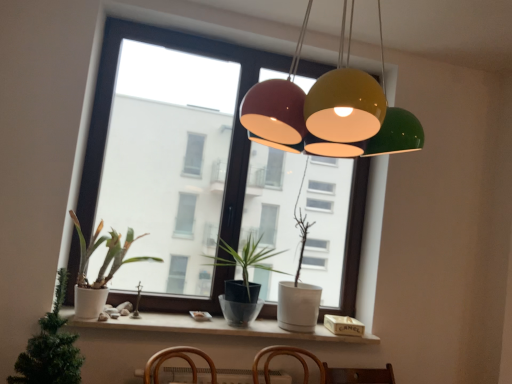
Identify the location of white matte pot at left, acting as the 2th houseplant starting from the back. This screenshot has width=512, height=384. (100, 268).

You are a GUI agent. You are given a task and a screenshot of the screen. Output one action in this format:
    pyautogui.click(x=<x>, y=<y>)
    Task: Click on the white matte pot at left, which is the 1th houseplant in front-to-back order
    This screenshot has width=512, height=384.
    Given the screenshot: What is the action you would take?
    pyautogui.click(x=50, y=349)

Is point (152, 330) closer to viewer compared to point (242, 321)?

That is True.

Is white matte window sill at lower center closer to camera compared to matte black pot at center, arranged as the 1th houseplant when viewed from the back?

Yes, the depth of white matte window sill at lower center is less than that of matte black pot at center, arranged as the 1th houseplant when viewed from the back.

In the scene shown: How different are the orientations of white matte window sill at lower center and matte black pot at center, the third houseplant from the front, in degrees?

The angular difference between white matte window sill at lower center and matte black pot at center, the third houseplant from the front, is 0.824 degrees.

Can you confirm if white matte window sill at lower center is thinner than matte black pot at center, arranged as the 1th houseplant when viewed from the back?

Indeed, white matte window sill at lower center has a lesser width compared to matte black pot at center, arranged as the 1th houseplant when viewed from the back.

From the image's perspective, which one is positioned higher, white matte pot at left, which is the third houseplant in back-to-front order, or matte black pot at center, arranged as the 1th houseplant when viewed from the back?

matte black pot at center, arranged as the 1th houseplant when viewed from the back, from the image's perspective.

Between white matte pot at left, which is the 1th houseplant in front-to-back order, and matte black pot at center, arranged as the 1th houseplant when viewed from the back, which one appears on the right side from the viewer's perspective?

From the viewer's perspective, matte black pot at center, arranged as the 1th houseplant when viewed from the back, appears more on the right side.

Who is more distant, white matte pot at left, which is the third houseplant in back-to-front order, or matte black pot at center, the third houseplant from the front?

Positioned behind is matte black pot at center, the third houseplant from the front.

Could you tell me if white matte pot at left, which is the third houseplant in back-to-front order, is turned towards matte black pot at center, the third houseplant from the front?

No, white matte pot at left, which is the third houseplant in back-to-front order, is not oriented towards matte black pot at center, the third houseplant from the front.

Who is bigger, matte black pot at center, the third houseplant from the front, or white matte window sill at lower center?

matte black pot at center, the third houseplant from the front.

From a real-world perspective, does matte black pot at center, the third houseplant from the front, sit lower than white matte window sill at lower center?

No, from a real-world perspective, matte black pot at center, the third houseplant from the front, is not beneath white matte window sill at lower center.

Is white matte window sill at lower center located within matte black pot at center, the third houseplant from the front?

No, white matte window sill at lower center is not inside matte black pot at center, the third houseplant from the front.

Is point (215, 265) closer or farther from the camera than point (283, 335)?

Point (215, 265).

Considering the positions of point (268, 254) and point (69, 349), is point (268, 254) closer or farther from the camera than point (69, 349)?

Point (268, 254) is positioned farther from the camera compared to point (69, 349).

Could you measure the distance between matte black pot at center, the third houseplant from the front, and white matte pot at left, which is the 1th houseplant in front-to-back order?

matte black pot at center, the third houseplant from the front, is 36.01 inches from white matte pot at left, which is the 1th houseplant in front-to-back order.

Would you consider matte black pot at center, arranged as the 1th houseplant when viewed from the back, to be distant from white matte pot at left, which is the 1th houseplant in front-to-back order?

matte black pot at center, arranged as the 1th houseplant when viewed from the back, is near white matte pot at left, which is the 1th houseplant in front-to-back order, not far away.

Could you tell me if matte black pot at center, the third houseplant from the front, is turned towards white matte pot at left, which is the third houseplant in back-to-front order?

No, matte black pot at center, the third houseplant from the front, does not turn towards white matte pot at left, which is the third houseplant in back-to-front order.

Consider the image. How far apart are transparent glass window at center and white matte window sill at lower center?

78.50 centimeters.

Can white matte window sill at lower center be found inside transparent glass window at center?

No, white matte window sill at lower center is located outside of transparent glass window at center.

From the image's perspective, is transparent glass window at center above white matte window sill at lower center?

Yes, from the image's perspective, transparent glass window at center is over white matte window sill at lower center.

Based on the photo, is transparent glass window at center to the right of white matte window sill at lower center from the viewer's perspective?

Indeed, transparent glass window at center is positioned on the right side of white matte window sill at lower center.

Considering the relative positions of white matte pot at left, which is the third houseplant in back-to-front order, and transparent glass window at center in the image provided, is white matte pot at left, which is the third houseplant in back-to-front order, to the left of transparent glass window at center from the viewer's perspective?

Indeed, white matte pot at left, which is the third houseplant in back-to-front order, is positioned on the left side of transparent glass window at center.

Between white matte pot at left, which is the 1th houseplant in front-to-back order, and transparent glass window at center, which one is positioned behind?

Positioned behind is transparent glass window at center.

Is white matte pot at left, which is the 1th houseplant in front-to-back order, inside or outside of transparent glass window at center?

white matte pot at left, which is the 1th houseplant in front-to-back order, is outside transparent glass window at center.

Considering the sizes of objects white matte pot at left, which is the third houseplant in back-to-front order, and transparent glass window at center in the image provided, who is thinner, white matte pot at left, which is the third houseplant in back-to-front order, or transparent glass window at center?

transparent glass window at center is thinner.

Which object is thinner, matte black pot at center, the third houseplant from the front, or white matte pot at left, acting as the 2th houseplant starting from the back?

Thinner between the two is white matte pot at left, acting as the 2th houseplant starting from the back.

Can you see matte black pot at center, arranged as the 1th houseplant when viewed from the back, touching white matte pot at left, the 2th houseplant positioned from the front?

matte black pot at center, arranged as the 1th houseplant when viewed from the back, and white matte pot at left, the 2th houseplant positioned from the front, are clearly separated.

From the image's perspective, is matte black pot at center, arranged as the 1th houseplant when viewed from the back, under white matte pot at left, acting as the 2th houseplant starting from the back?

Yes, from the image's perspective, matte black pot at center, arranged as the 1th houseplant when viewed from the back, is below white matte pot at left, acting as the 2th houseplant starting from the back.

Is point (227, 300) positioned before point (108, 239)?

No, (227, 300) is further to viewer.

Locate an element on the screen. The width and height of the screenshot is (512, 384). houseplant behind the white matte window sill at lower center is located at coordinates (243, 279).

I want to click on the 2nd houseplant to the right of the white matte pot at left, which is the 1th houseplant in front-to-back order, starting your count from the anchor, so click(243, 279).

When comparing their distances from white matte window sill at lower center, does white matte pot at left, which is the 1th houseplant in front-to-back order, or white matte pot at left, acting as the 2th houseplant starting from the back, seem closer?

The object closer to white matte window sill at lower center is white matte pot at left, acting as the 2th houseplant starting from the back.

Based on the photo, considering their positions, is white matte pot at left, the 2th houseplant positioned from the front, positioned further to white matte window sill at lower center than transparent glass window at center?

Based on the image, transparent glass window at center appears to be further to white matte window sill at lower center.

Which object lies further to the anchor point white matte pot at left, which is the 1th houseplant in front-to-back order, white matte pot at left, the 2th houseplant positioned from the front, or matte black pot at center, arranged as the 1th houseplant when viewed from the back?

matte black pot at center, arranged as the 1th houseplant when viewed from the back, lies further to white matte pot at left, which is the 1th houseplant in front-to-back order, than the other object.

Considering their positions, is transparent glass window at center positioned further to white matte pot at left, which is the third houseplant in back-to-front order, than white matte window sill at lower center?

transparent glass window at center is positioned further to the anchor white matte pot at left, which is the third houseplant in back-to-front order.

Looking at the image, which one is located closer to transparent glass window at center, white matte pot at left, acting as the 2th houseplant starting from the back, or white matte window sill at lower center?

white matte pot at left, acting as the 2th houseplant starting from the back.

From the image, which object appears to be nearer to white matte pot at left, which is the third houseplant in back-to-front order, white matte pot at left, acting as the 2th houseplant starting from the back, or transparent glass window at center?

Based on the image, white matte pot at left, acting as the 2th houseplant starting from the back, appears to be nearer to white matte pot at left, which is the third houseplant in back-to-front order.

Based on their spatial positions, is white matte window sill at lower center or white matte pot at left, acting as the 2th houseplant starting from the back, further from matte black pot at center, the third houseplant from the front?

white matte pot at left, acting as the 2th houseplant starting from the back.

Looking at the image, which one is located further to white matte window sill at lower center, matte black pot at center, the third houseplant from the front, or white matte pot at left, which is the 1th houseplant in front-to-back order?

white matte pot at left, which is the 1th houseplant in front-to-back order, is further to white matte window sill at lower center.

The image size is (512, 384). I want to click on window sill between white matte pot at left, which is the 1th houseplant in front-to-back order, and matte black pot at center, arranged as the 1th houseplant when viewed from the back, from left to right, so click(x=212, y=327).

Where is `houseplant between white matte pot at left, which is the 1th houseplant in front-to-back order, and white matte window sill at lower center from left to right`? The image size is (512, 384). houseplant between white matte pot at left, which is the 1th houseplant in front-to-back order, and white matte window sill at lower center from left to right is located at coordinates (100, 268).

Locate an element on the screen. window sill located between white matte pot at left, which is the 1th houseplant in front-to-back order, and transparent glass window at center in the depth direction is located at coordinates (212, 327).

Locate an element on the screen. window sill situated between white matte pot at left, acting as the 2th houseplant starting from the back, and matte black pot at center, the third houseplant from the front, from left to right is located at coordinates (212, 327).